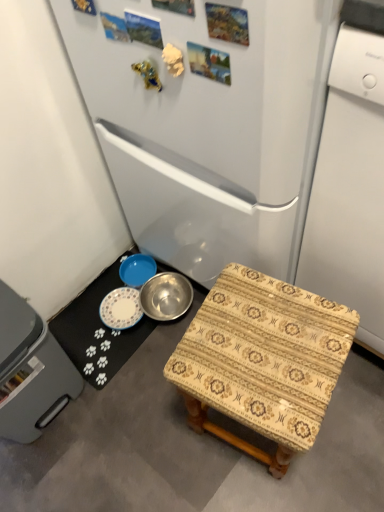
This screenshot has height=512, width=384. In order to click on unoccupied region to the right of patterned fabric stool at lower right in this screenshot , I will do `click(352, 417)`.